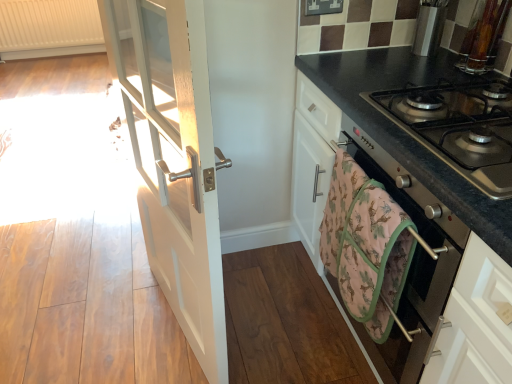
Question: From the image's perspective, is white wood door at left on white textured radiator at upper left?

Choices:
 (A) no
 (B) yes

Answer: (A)

Question: Considering the relative sizes of white wood door at left and white textured radiator at upper left in the image provided, is white wood door at left wider than white textured radiator at upper left?

Choices:
 (A) no
 (B) yes

Answer: (A)

Question: Would you consider white wood door at left to be distant from white textured radiator at upper left?

Choices:
 (A) no
 (B) yes

Answer: (B)

Question: Is white textured radiator at upper left inside white wood door at left?

Choices:
 (A) yes
 (B) no

Answer: (B)

Question: Is white wood door at left positioned in front of white textured radiator at upper left?

Choices:
 (A) no
 (B) yes

Answer: (B)

Question: Is stainless steel gas stove at right in front of or behind white textured radiator at upper left in the image?

Choices:
 (A) behind
 (B) front

Answer: (B)

Question: From their relative heights in the image, would you say stainless steel gas stove at right is taller or shorter than white textured radiator at upper left?

Choices:
 (A) short
 (B) tall

Answer: (A)

Question: Does point (465, 130) appear closer or farther from the camera than point (84, 38)?

Choices:
 (A) closer
 (B) farther

Answer: (A)

Question: From a real-world perspective, is stainless steel gas stove at right above or below white textured radiator at upper left?

Choices:
 (A) below
 (B) above

Answer: (B)

Question: In terms of height, does white wood door at left look taller or shorter compared to white textured radiator at upper left?

Choices:
 (A) short
 (B) tall

Answer: (B)

Question: Considering the positions of point (214, 279) and point (40, 8), is point (214, 279) closer or farther from the camera than point (40, 8)?

Choices:
 (A) closer
 (B) farther

Answer: (A)

Question: Is white wood door at left in front of or behind white textured radiator at upper left in the image?

Choices:
 (A) behind
 (B) front

Answer: (B)

Question: Considering the relative positions of white wood door at left and white textured radiator at upper left in the image provided, is white wood door at left to the left or to the right of white textured radiator at upper left?

Choices:
 (A) left
 (B) right

Answer: (B)

Question: From a real-world perspective, relative to stainless steel gas stove at right, is metallic oven at right vertically above or below?

Choices:
 (A) above
 (B) below

Answer: (B)

Question: Is metallic oven at right inside or outside of stainless steel gas stove at right?

Choices:
 (A) inside
 (B) outside

Answer: (B)